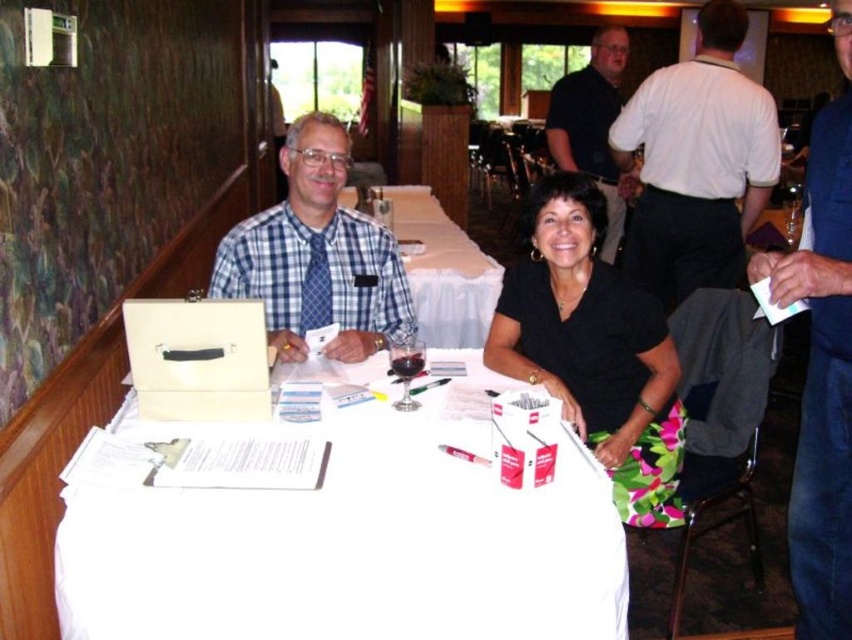
Is point (320, 513) less distant than point (561, 116)?

Yes, point (320, 513) is closer to viewer.

Between white paper at center and matte black shirt at upper center, which one appears on the right side from the viewer's perspective?

matte black shirt at upper center

Measure the distance between white paper at center and camera.

They are 1.31 meters apart.

At what (x,y) coordinates should I click in order to perform the action: click on white paper at center. Please return your answer as a coordinate pair (x, y). Image resolution: width=852 pixels, height=640 pixels. Looking at the image, I should click on (350, 548).

Which is behind, point (527, 324) or point (839, 266)?

Point (527, 324)

What do you see at coordinates (593, 348) in the screenshot? I see `black fabric skirt at lower center` at bounding box center [593, 348].

Who is more distant from viewer, [568,269] or [804,554]?

Point [568,269]

The width and height of the screenshot is (852, 640). I want to click on black fabric skirt at lower center, so click(x=593, y=348).

Between blue shirt at center and white cloth at center, which one has less height?

Standing shorter between the two is white cloth at center.

Is blue shirt at center smaller than white cloth at center?

Indeed, blue shirt at center has a smaller size compared to white cloth at center.

Identify the location of blue shirt at center. This screenshot has width=852, height=640. (822, 364).

The width and height of the screenshot is (852, 640). Find the location of `blue shirt at center`. blue shirt at center is located at coordinates (822, 364).